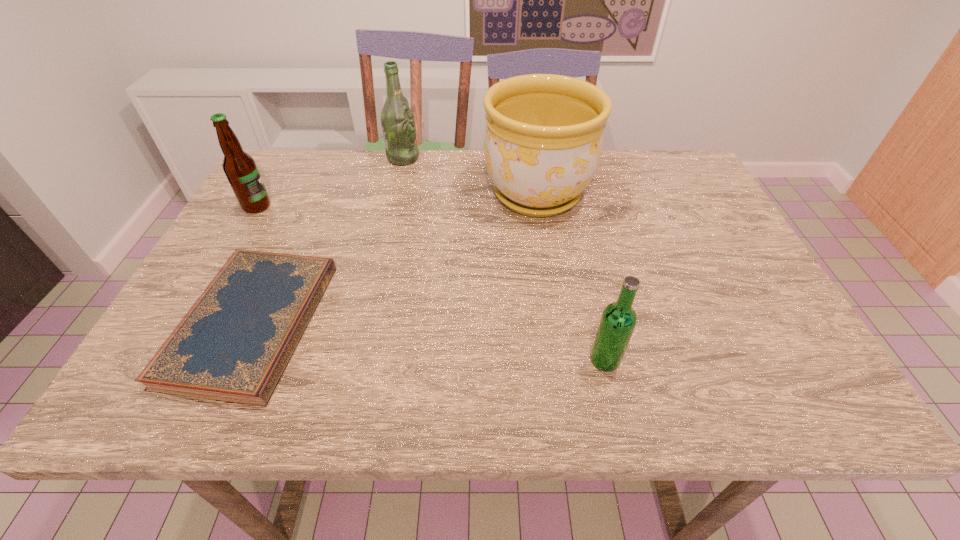
The width and height of the screenshot is (960, 540). I want to click on empty location between the shortest object and the flowerpot, so click(395, 259).

You are a GUI agent. You are given a task and a screenshot of the screen. Output one action in this format:
    pyautogui.click(x=<x>, y=<y>)
    Task: Click on the free space between the shortest beer bottle and the second nearest beer bottle
    The image size is (960, 540).
    Given the screenshot: What is the action you would take?
    pyautogui.click(x=431, y=283)

The height and width of the screenshot is (540, 960). I want to click on object identified as the third closest to the second nearest beer bottle, so click(543, 140).

What are the coordinates of `the second closest object to the flowerpot` in the screenshot? It's located at (235, 342).

Where is `beer bottle that is the second nearest to the rightmost beer bottle`? The image size is (960, 540). beer bottle that is the second nearest to the rightmost beer bottle is located at coordinates (239, 167).

Point out which beer bottle is positioned as the second nearest to the nearest beer bottle. Please provide its 2D coordinates. Your answer should be formatted as a tuple, i.e. [(x, y)], where the tuple contains the x and y coordinates of a point satisfying the conditions above.

[(239, 167)]

Image resolution: width=960 pixels, height=540 pixels. Find the location of `free point that satisfies the following two spatial constraints: 1. on the back side of the flowerpot; 2. on the surface of the farthest beer bottle`. free point that satisfies the following two spatial constraints: 1. on the back side of the flowerpot; 2. on the surface of the farthest beer bottle is located at coordinates (531, 158).

The height and width of the screenshot is (540, 960). What are the coordinates of `vacant position in the image that satisfies the following two spatial constraints: 1. on the front side of the shortest beer bottle; 2. on the right side of the shortest object` in the screenshot? It's located at (235, 360).

Find the location of a particular element. This screenshot has width=960, height=540. free region that satisfies the following two spatial constraints: 1. on the surface of the rightmost beer bottle; 2. on the left side of the third object from right to left is located at coordinates (357, 360).

Identify the location of free spot that satisfies the following two spatial constraints: 1. on the surface of the farthest beer bottle; 2. on the left side of the nearest beer bottle. point(357,360).